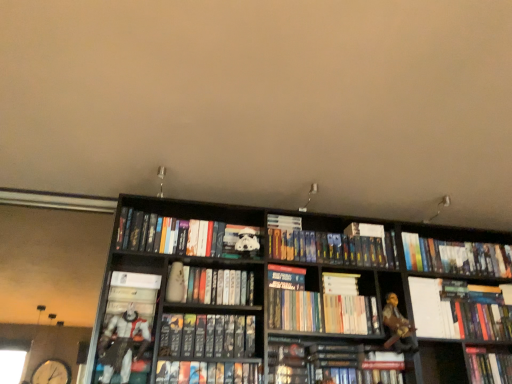
This screenshot has width=512, height=384. Describe the element at coordinates (185, 236) in the screenshot. I see `white matte stormtrooper helmet at center, the 2th book in the left-to-right sequence` at that location.

The image size is (512, 384). What do you see at coordinates (286, 277) in the screenshot?
I see `hardcover book at center, marked as the 6th book in a right-to-left arrangement` at bounding box center [286, 277].

Find the location of a particular element. hardcover book at center, positioned as the 8th book in left-to-right order is located at coordinates (328, 245).

Image resolution: width=512 pixels, height=384 pixels. In order to click on hardcover book at center, the 4th book from the left in this screenshot , I will do `click(209, 286)`.

Identify the location of hardcover books at center, the 5th book from the right. pos(321,311).

Where is `white matte stormtrooper helmet at center, acting as the 10th book starting from the right`? This screenshot has width=512, height=384. white matte stormtrooper helmet at center, acting as the 10th book starting from the right is located at coordinates (185, 236).

Is hardcover books at center, the 5th book from the right, facing towards metallic silver figure at left, which is the eleventh book from right to left?

No, hardcover books at center, the 5th book from the right, does not turn towards metallic silver figure at left, which is the eleventh book from right to left.

Is hardcover books at center, arranged as the 7th book when viewed from the left, thinner than metallic silver figure at left, which is the eleventh book from right to left?

Correct, the width of hardcover books at center, arranged as the 7th book when viewed from the left, is less than that of metallic silver figure at left, which is the eleventh book from right to left.

Considering the positions of objects hardcover books at center, arranged as the 7th book when viewed from the left, and metallic silver figure at left, which is the eleventh book from right to left, in the image provided, who is more to the left, hardcover books at center, arranged as the 7th book when viewed from the left, or metallic silver figure at left, which is the eleventh book from right to left,?

metallic silver figure at left, which is the eleventh book from right to left, is more to the left.

Does point (317, 295) appear closer or farther from the camera than point (138, 357)?

Clearly, point (317, 295) is more distant from the camera than point (138, 357).

From the hardcover book at center, which appears as the ninth book when viewed from the right, count the 1st book to the left and point to it. Please provide its 2D coordinates.

[(185, 236)]

How different are the orientations of white matte stormtrooper helmet at center, acting as the 10th book starting from the right, and hardcover book at center, which appears as the ninth book when viewed from the right, in degrees?

white matte stormtrooper helmet at center, acting as the 10th book starting from the right, and hardcover book at center, which appears as the ninth book when viewed from the right, are facing 1.72 degrees away from each other.

In the image, is white matte stormtrooper helmet at center, acting as the 10th book starting from the right, positioned in front of or behind hardcover book at center, which appears as the ninth book when viewed from the right?

Visually, white matte stormtrooper helmet at center, acting as the 10th book starting from the right, is located behind hardcover book at center, which appears as the ninth book when viewed from the right.

Considering the sizes of objects hardcover book at lower right, the 1th book viewed from the right, and hardcover book at right, which appears as the third book when viewed from the right, in the image provided, who is shorter, hardcover book at lower right, the 1th book viewed from the right, or hardcover book at right, which appears as the third book when viewed from the right,?

Standing shorter between the two is hardcover book at lower right, the 1th book viewed from the right.

Considering the positions of objects hardcover book at lower right, which is the eleventh book from left to right, and hardcover book at right, which appears as the third book when viewed from the right, in the image provided, who is behind, hardcover book at lower right, which is the eleventh book from left to right, or hardcover book at right, which appears as the third book when viewed from the right,?

Positioned behind is hardcover book at right, which appears as the third book when viewed from the right.

Are hardcover book at lower right, the 1th book viewed from the right, and hardcover book at right, which is the ninth book from left to right, located far from each other?

No.

From the picture: Looking at their sizes, would you say hardcover books at center, the 5th book from the right, is wider or thinner than hardcover book at center, the 4th book from the left?

hardcover books at center, the 5th book from the right, is wider than hardcover book at center, the 4th book from the left.

Is hardcover books at center, arranged as the 7th book when viewed from the left, taller or shorter than hardcover book at center, the 4th book from the left?

Clearly, hardcover books at center, arranged as the 7th book when viewed from the left, is taller compared to hardcover book at center, the 4th book from the left.

Is hardcover books at center, arranged as the 7th book when viewed from the left, next to hardcover book at center, the 4th book from the left, and touching it?

No, hardcover books at center, arranged as the 7th book when viewed from the left, is not beside hardcover book at center, the 4th book from the left.

Between hardcover book at center, the 4th book from the left, and hardcover book at center, acting as the fifth book starting from the left, which one has larger size?

With larger size is hardcover book at center, the 4th book from the left.

What are the coordinates of `book that is the 5th one when counting upward from the hardcover book at center, the seventh book from the right (from the image's perspective)` in the screenshot? It's located at [x=209, y=286].

Are hardcover book at center, marked as the 8th book in a right-to-left arrangement, and hardcover book at center, acting as the fifth book starting from the left, far apart?

They are positioned close to each other.

Considering the sizes of objects hardcover book at center, the third book from the left, and white glossy book at right, the tenth book positioned from the left, in the image provided, who is thinner, hardcover book at center, the third book from the left, or white glossy book at right, the tenth book positioned from the left,?

Thinner between the two is white glossy book at right, the tenth book positioned from the left.

Does hardcover book at center, which appears as the ninth book when viewed from the right, turn towards white glossy book at right, which is the 2th book from right to left?

No.

Can you confirm if hardcover book at center, the third book from the left, is positioned to the right of white glossy book at right, the tenth book positioned from the left?

In fact, hardcover book at center, the third book from the left, is to the left of white glossy book at right, the tenth book positioned from the left.

From a real-world perspective, is hardcover book at lower right, the 1th book viewed from the right, above or below hardcover book at center, acting as the fifth book starting from the left?

hardcover book at lower right, the 1th book viewed from the right, is situated higher than hardcover book at center, acting as the fifth book starting from the left, in the real world.

Between hardcover book at lower right, the 1th book viewed from the right, and hardcover book at center, the seventh book from the right, which one has smaller width?

hardcover book at lower right, the 1th book viewed from the right.

Measure the distance between hardcover book at lower right, which is the eleventh book from left to right, and hardcover book at center, acting as the fifth book starting from the left.

hardcover book at lower right, which is the eleventh book from left to right, is 1.39 meters away from hardcover book at center, acting as the fifth book starting from the left.

Choose the correct answer: Is hardcover book at lower right, the 1th book viewed from the right, inside hardcover book at center, acting as the fifth book starting from the left, or outside it?

The correct answer is: outside.

The width and height of the screenshot is (512, 384). Identify the location of book that is the 3rd object located behind the metallic silver figure at left, which appears as the 1th book when viewed from the left. (321, 311).

Where is `the 7th book below the white matte stormtrooper helmet at center, acting as the 10th book starting from the right (from a real-world perspective)`? This screenshot has height=384, width=512. the 7th book below the white matte stormtrooper helmet at center, acting as the 10th book starting from the right (from a real-world perspective) is located at coordinates (207, 336).

Estimate the real-world distances between objects in this image. Which object is closer to hardcover book at center, the seventh book from the right, hardcover book at right, which appears as the third book when viewed from the right, or hardcover books at center, arranged as the 7th book when viewed from the left?

hardcover books at center, arranged as the 7th book when viewed from the left.

Considering their positions, is hardcover book at center, acting as the fifth book starting from the left, positioned further to hardcover book at center, the 4th book from the left, than white glossy book at right, which is the 2th book from right to left?

The object further to hardcover book at center, the 4th book from the left, is white glossy book at right, which is the 2th book from right to left.

When comparing their distances from hardcover book at center, marked as the 8th book in a right-to-left arrangement, does white glossy book at right, the tenth book positioned from the left, or white matte stormtrooper helmet at center, acting as the 10th book starting from the right, seem closer?

The object closer to hardcover book at center, marked as the 8th book in a right-to-left arrangement, is white matte stormtrooper helmet at center, acting as the 10th book starting from the right.

Based on their spatial positions, is hardcover book at center, the 4th book from the left, or white matte stormtrooper helmet at center, acting as the 10th book starting from the right, further from hardcover book at right, which appears as the third book when viewed from the right?

Based on the image, white matte stormtrooper helmet at center, acting as the 10th book starting from the right, appears to be further to hardcover book at right, which appears as the third book when viewed from the right.

From the picture: Based on their spatial positions, is hardcover book at center, the third book from the left, or hardcover book at center, marked as the 8th book in a right-to-left arrangement, further from white matte stormtrooper helmet at center, the 2th book in the left-to-right sequence?

hardcover book at center, the third book from the left.

From the image, which object appears to be nearer to hardcover book at center, the seventh book from the right, hardcover book at center, the third book from the left, or hardcover book at right, which appears as the third book when viewed from the right?

hardcover book at center, the third book from the left, is positioned closer to the anchor hardcover book at center, the seventh book from the right.

When comparing their distances from hardcover book at center, acting as the fifth book starting from the left, does hardcover book at center, the 4th book from the right, or hardcover books at center, the 5th book from the right, seem further?

hardcover book at center, the 4th book from the right, is further to hardcover book at center, acting as the fifth book starting from the left.

Estimate the real-world distances between objects in this image. Which object is closer to white paper at upper right, hardcover book at lower right, the 1th book viewed from the right, or hardcover book at center, the 4th book from the right?

Among the two, hardcover book at lower right, the 1th book viewed from the right, is located nearer to white paper at upper right.

Image resolution: width=512 pixels, height=384 pixels. I want to click on paperback book between white matte stormtrooper helmet at center, the 2th book in the left-to-right sequence, and white glossy book at right, the tenth book positioned from the left, so click(426, 306).

What are the coordinates of `paperback book between hardcover book at center, marked as the 6th book in a right-to-left arrangement, and white glossy book at right, the tenth book positioned from the left, in the horizontal direction` in the screenshot? It's located at (426, 306).

Where is `paperback book between hardcover book at center, the 4th book from the left, and hardcover book at lower right, which is the eleventh book from left to right, from left to right`? The height and width of the screenshot is (384, 512). paperback book between hardcover book at center, the 4th book from the left, and hardcover book at lower right, which is the eleventh book from left to right, from left to right is located at coordinates (426, 306).

I want to click on paperback book located between hardcover book at center, the seventh book from the right, and white glossy book at right, the tenth book positioned from the left, in the left-right direction, so click(x=426, y=306).